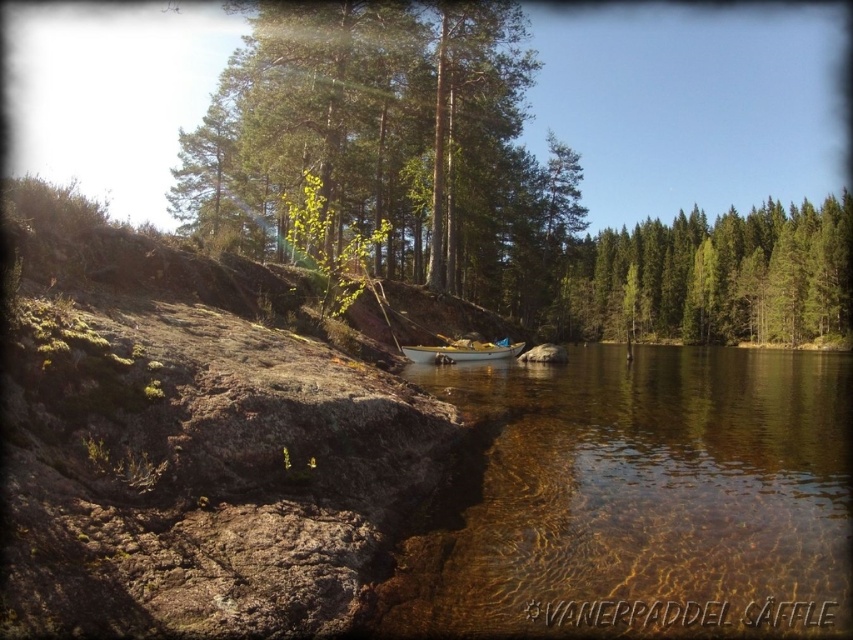
Which is above, green leafy tree at upper center or white plastic canoe at center?

green leafy tree at upper center

Which is behind, point (373, 32) or point (440, 353)?

Positioned behind is point (373, 32).

Identify the location of green leafy tree at upper center. (395, 138).

Is green leafy tree at upper center positioned behind green matte tree at center?

No, green leafy tree at upper center is in front of green matte tree at center.

Which is in front, point (241, 144) or point (683, 300)?

Point (241, 144) is more forward.

What do you see at coordinates (395, 138) in the screenshot? This screenshot has width=853, height=640. I see `green leafy tree at upper center` at bounding box center [395, 138].

Where is `green leafy tree at upper center`? This screenshot has width=853, height=640. green leafy tree at upper center is located at coordinates (395, 138).

Is clear water at center wider than white plastic canoe at center?

Correct, the width of clear water at center exceeds that of white plastic canoe at center.

Who is positioned more to the left, clear water at center or white plastic canoe at center?

From the viewer's perspective, white plastic canoe at center appears more on the left side.

This screenshot has height=640, width=853. What are the coordinates of `clear water at center` in the screenshot? It's located at (636, 497).